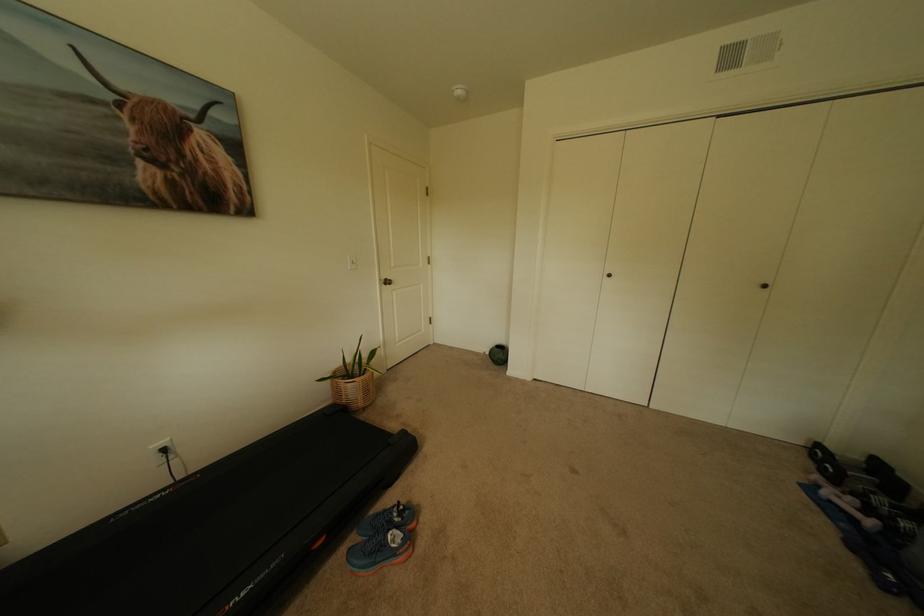
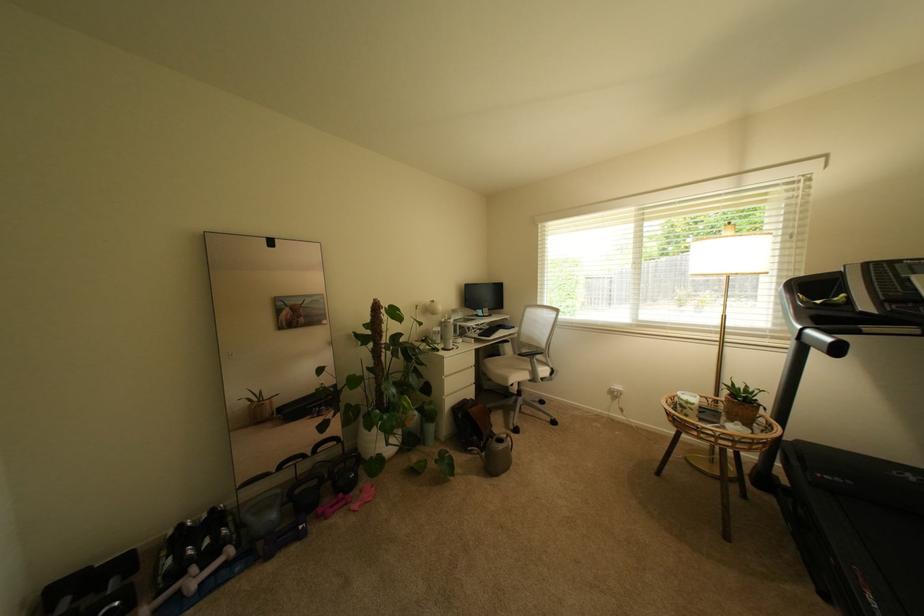
Locate, in the second image, the point that corresponds to (841,471) in the first image.

(126, 604)